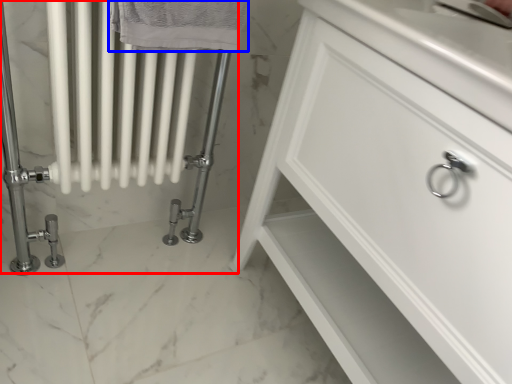
Question: Among these objects, which one is farthest to the camera, bath (highlighted by a red box) or bath towel (highlighted by a blue box)?

Choices:
 (A) bath
 (B) bath towel

Answer: (A)